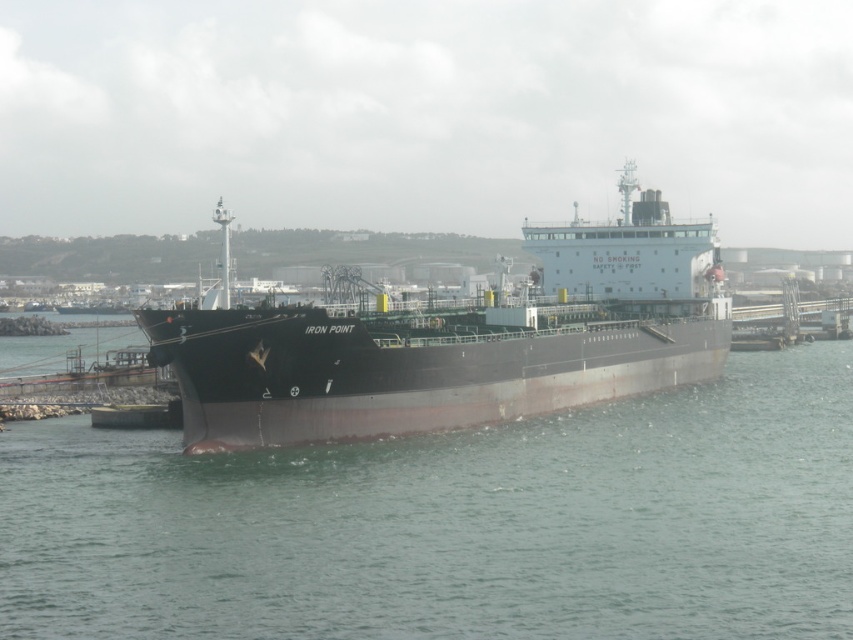
Does green matte water at center appear on the right side of black matte ship at center?

Incorrect, green matte water at center is not on the right side of black matte ship at center.

Looking at this image, which is more to the left, green matte water at center or black matte ship at center?

green matte water at center is more to the left.

The width and height of the screenshot is (853, 640). Identify the location of green matte water at center. point(454,524).

In order to click on green matte water at center in this screenshot , I will do `click(454, 524)`.